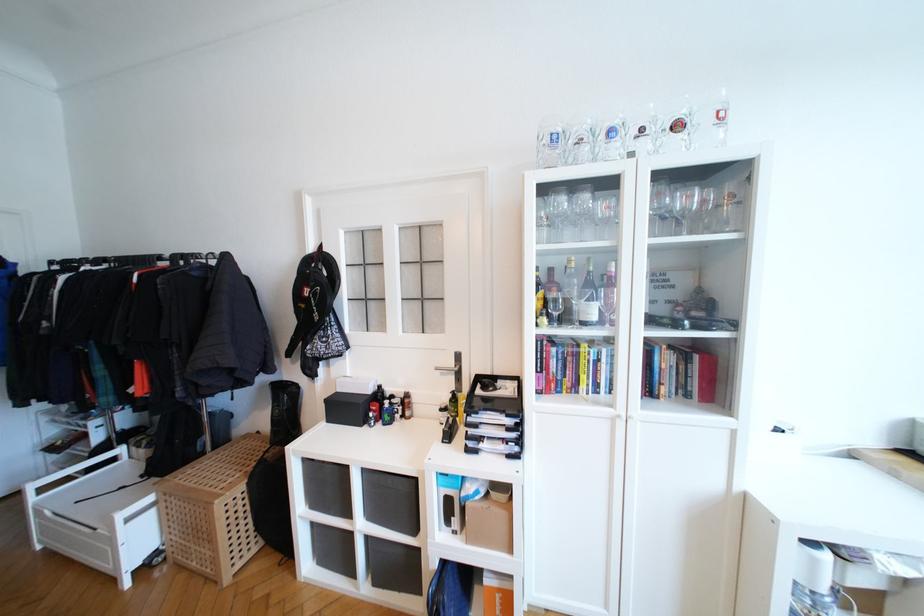
Image resolution: width=924 pixels, height=616 pixels. Identify the location of wicker laundry basket. (212, 511).